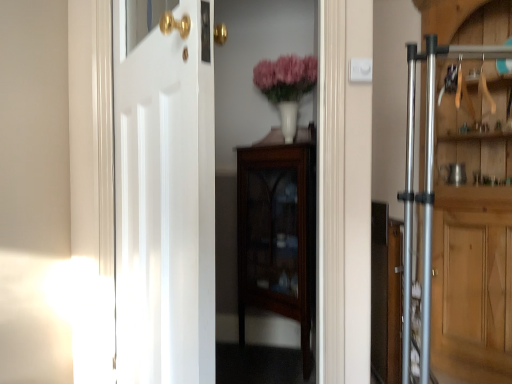
Measure the distance between mahogany glass-front cabinet at center and camera.

mahogany glass-front cabinet at center is 1.76 meters from camera.

Describe the element at coordinates (459, 215) in the screenshot. This screenshot has height=384, width=512. I see `silver metallic door at right, the 2th door in the front-to-back sequence` at that location.

You are a GUI agent. You are given a task and a screenshot of the screen. Output one action in this format:
    pyautogui.click(x=<x>, y=<y>)
    Task: Click on the pink matte vase at upper center
    The height and width of the screenshot is (384, 512).
    Given the screenshot: What is the action you would take?
    pyautogui.click(x=286, y=86)

The width and height of the screenshot is (512, 384). I want to click on mahogany glass-front cabinet at center, so click(278, 231).

Is mahogany glass-front cabinet at center oriented away from silver metallic door at right, the 1th door viewed from the right?

That's not correct — mahogany glass-front cabinet at center is not looking away from silver metallic door at right, the 1th door viewed from the right.

Between mahogany glass-front cabinet at center and silver metallic door at right, the 2th door in the front-to-back sequence, which one has larger size?

silver metallic door at right, the 2th door in the front-to-back sequence.

This screenshot has height=384, width=512. Find the location of `cabinetry that is under the silver metallic door at right, the 2th door in the front-to-back sequence (from a real-world perspective)`. cabinetry that is under the silver metallic door at right, the 2th door in the front-to-back sequence (from a real-world perspective) is located at coordinates (278, 231).

From a real-world perspective, is mahogany glass-front cabinet at center physically below silver metallic door at right, the 2th door in the front-to-back sequence?

Yes, from a real-world perspective, mahogany glass-front cabinet at center is under silver metallic door at right, the 2th door in the front-to-back sequence.

Which of these two, mahogany glass-front cabinet at center or white glossy door at center, which is counted as the first door, starting from the front, is wider?

Wider between the two is mahogany glass-front cabinet at center.

Is mahogany glass-front cabinet at center far away from white glossy door at center, which is the second door in right-to-left order?

No.

Is mahogany glass-front cabinet at center located outside white glossy door at center, which is the second door in right-to-left order?

That's correct, mahogany glass-front cabinet at center is outside of white glossy door at center, which is the second door in right-to-left order.

Can you confirm if mahogany glass-front cabinet at center is bigger than white glossy door at center, which ranks as the first door in left-to-right order?

Yes.

How many degrees apart are the facing directions of white glossy door at center, which is the second door in right-to-left order, and pink matte vase at upper center?

They differ by 128 degrees in their facing directions.

Is white glossy door at center, which is the second door in right-to-left order, taller or shorter than pink matte vase at upper center?

Clearly, white glossy door at center, which is the second door in right-to-left order, is taller compared to pink matte vase at upper center.

Is white glossy door at center, which is the second door in right-to-left order, spatially inside pink matte vase at upper center, or outside of it?

white glossy door at center, which is the second door in right-to-left order, is not enclosed by pink matte vase at upper center.

From a real-world perspective, is white glossy door at center, which is counted as the first door, starting from the front, physically above pink matte vase at upper center?

Actually, white glossy door at center, which is counted as the first door, starting from the front, is physically below pink matte vase at upper center in the real world.

Which of these two, silver metallic door at right, which is the 1th door from back to front, or white glossy door at center, which ranks as the first door in left-to-right order, is thinner?

white glossy door at center, which ranks as the first door in left-to-right order.

What's the angular difference between silver metallic door at right, the second door viewed from the left, and white glossy door at center, which is counted as the first door, starting from the front,'s facing directions?

171 degrees.

Could you tell me if silver metallic door at right, which is the 1th door from back to front, is facing white glossy door at center, which is the second door in right-to-left order?

Yes, silver metallic door at right, which is the 1th door from back to front, is oriented towards white glossy door at center, which is the second door in right-to-left order.

Is there a large distance between silver metallic door at right, the second door viewed from the left, and white glossy door at center, which is counted as the first door, starting from the front?

Yes, silver metallic door at right, the second door viewed from the left, is far from white glossy door at center, which is counted as the first door, starting from the front.

At what (x,y) coordinates should I click in order to perform the action: click on the 1st door in front of the mahogany glass-front cabinet at center, counting from the anchor's position. Please return your answer as a coordinate pair (x, y). The width and height of the screenshot is (512, 384). Looking at the image, I should click on (459, 215).

From the image's perspective, is silver metallic door at right, which is the 1th door from back to front, located above or below mahogany glass-front cabinet at center?

Based on their image positions, silver metallic door at right, which is the 1th door from back to front, is located above mahogany glass-front cabinet at center.

Would you say silver metallic door at right, the 1th door viewed from the right, is inside or outside mahogany glass-front cabinet at center?

silver metallic door at right, the 1th door viewed from the right, is not inside mahogany glass-front cabinet at center, it's outside.

Which is less distant, [309,71] or [153,251]?

Clearly, point [309,71] is more distant from the camera than point [153,251].

Can you confirm if pink matte vase at upper center is taller than white glossy door at center, which is counted as the first door, starting from the front?

No.

What's the angular difference between pink matte vase at upper center and white glossy door at center, which is counted as the first door, starting from the front,'s facing directions?

128 degrees.

From a real-world perspective, which is physically above, pink matte vase at upper center or white glossy door at center, which is counted as the 2th door, starting from the back?

pink matte vase at upper center is physically above.

Can you confirm if pink matte vase at upper center is bigger than silver metallic door at right, the 2th door in the front-to-back sequence?

No.

Is the position of pink matte vase at upper center more distant than that of silver metallic door at right, the 2th door in the front-to-back sequence?

Yes, pink matte vase at upper center is behind silver metallic door at right, the 2th door in the front-to-back sequence.

Is pink matte vase at upper center looking in the opposite direction of silver metallic door at right, the second door viewed from the left?

That's not correct — pink matte vase at upper center is not looking away from silver metallic door at right, the second door viewed from the left.

Consider the image. From the image's perspective, which is above, pink matte vase at upper center or silver metallic door at right, which is the 1th door from back to front?

pink matte vase at upper center is shown above in the image.

Identify the location of cabinetry located behind the silver metallic door at right, the 1th door viewed from the right. (278, 231).

Locate an element on the screen. cabinetry below the white glossy door at center, which is counted as the first door, starting from the front (from the image's perspective) is located at coordinates (278, 231).

When comparing their distances from mahogany glass-front cabinet at center, does pink matte vase at upper center or silver metallic door at right, which is the 1th door from back to front, seem closer?

pink matte vase at upper center is closer to mahogany glass-front cabinet at center.

From the image, which object appears to be farther from pink matte vase at upper center, silver metallic door at right, the 1th door viewed from the right, or mahogany glass-front cabinet at center?

The object further to pink matte vase at upper center is silver metallic door at right, the 1th door viewed from the right.

Based on their spatial positions, is mahogany glass-front cabinet at center or pink matte vase at upper center further from silver metallic door at right, the second door viewed from the left?

The object further to silver metallic door at right, the second door viewed from the left, is mahogany glass-front cabinet at center.

When comparing their distances from pink matte vase at upper center, does mahogany glass-front cabinet at center or silver metallic door at right, the 1th door viewed from the right, seem closer?

mahogany glass-front cabinet at center is closer to pink matte vase at upper center.

From the image, which object appears to be nearer to silver metallic door at right, the second door viewed from the left, pink matte vase at upper center or white glossy door at center, which is the second door in right-to-left order?

pink matte vase at upper center.

In the scene shown: Considering their positions, is silver metallic door at right, the 1th door viewed from the right, positioned further to mahogany glass-front cabinet at center than white glossy door at center, which ranks as the first door in left-to-right order?

Based on the image, white glossy door at center, which ranks as the first door in left-to-right order, appears to be further to mahogany glass-front cabinet at center.

From the image, which object appears to be nearer to mahogany glass-front cabinet at center, white glossy door at center, which is counted as the first door, starting from the front, or pink matte vase at upper center?

Based on the image, pink matte vase at upper center appears to be nearer to mahogany glass-front cabinet at center.

Based on their spatial positions, is silver metallic door at right, the second door viewed from the left, or pink matte vase at upper center further from mahogany glass-front cabinet at center?

Among the two, silver metallic door at right, the second door viewed from the left, is located further to mahogany glass-front cabinet at center.

Locate an element on the screen. cabinetry located between white glossy door at center, which is counted as the 2th door, starting from the back, and silver metallic door at right, the second door viewed from the left, in the left-right direction is located at coordinates (278, 231).

Where is `floral arrangement between mahogany glass-front cabinet at center and silver metallic door at right, which is the 1th door from back to front, in the horizontal direction`? floral arrangement between mahogany glass-front cabinet at center and silver metallic door at right, which is the 1th door from back to front, in the horizontal direction is located at coordinates (286, 86).

Where is `floral arrangement located between white glossy door at center, which is counted as the 2th door, starting from the back, and silver metallic door at right, the second door viewed from the left, in the left-right direction`? The height and width of the screenshot is (384, 512). floral arrangement located between white glossy door at center, which is counted as the 2th door, starting from the back, and silver metallic door at right, the second door viewed from the left, in the left-right direction is located at coordinates (286, 86).

Locate an element on the screen. This screenshot has height=384, width=512. cabinetry between white glossy door at center, which ranks as the first door in left-to-right order, and pink matte vase at upper center, along the z-axis is located at coordinates (278, 231).